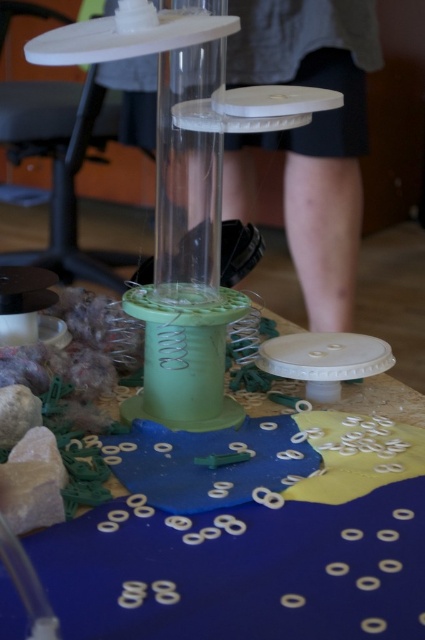
Can you confirm if blue fabric at center is positioned below transparent plastic glass vase at center?

Yes, blue fabric at center is below transparent plastic glass vase at center.

Which of these two, blue fabric at center or transparent plastic glass vase at center, stands shorter?

blue fabric at center

Find the location of a particular element. This screenshot has width=425, height=640. blue fabric at center is located at coordinates tap(249, 536).